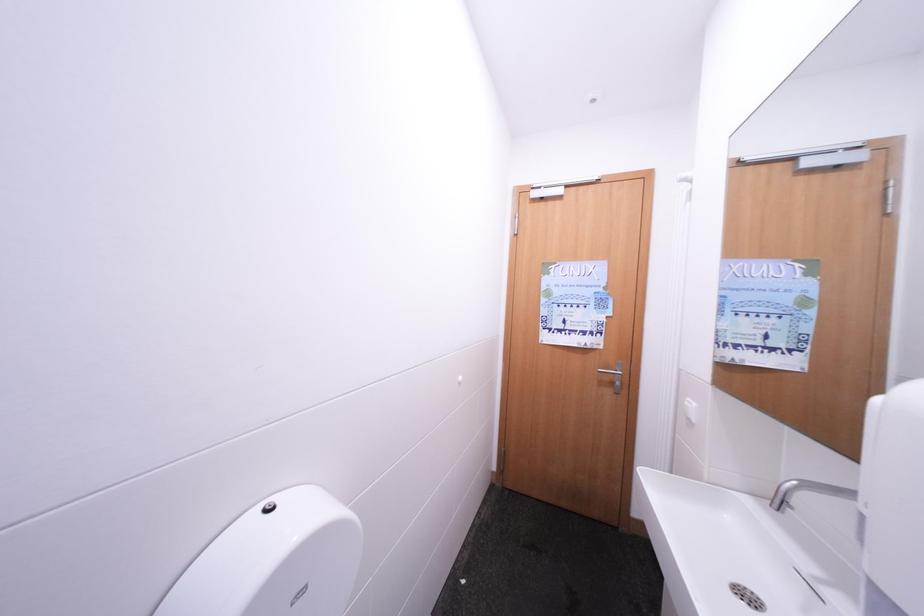
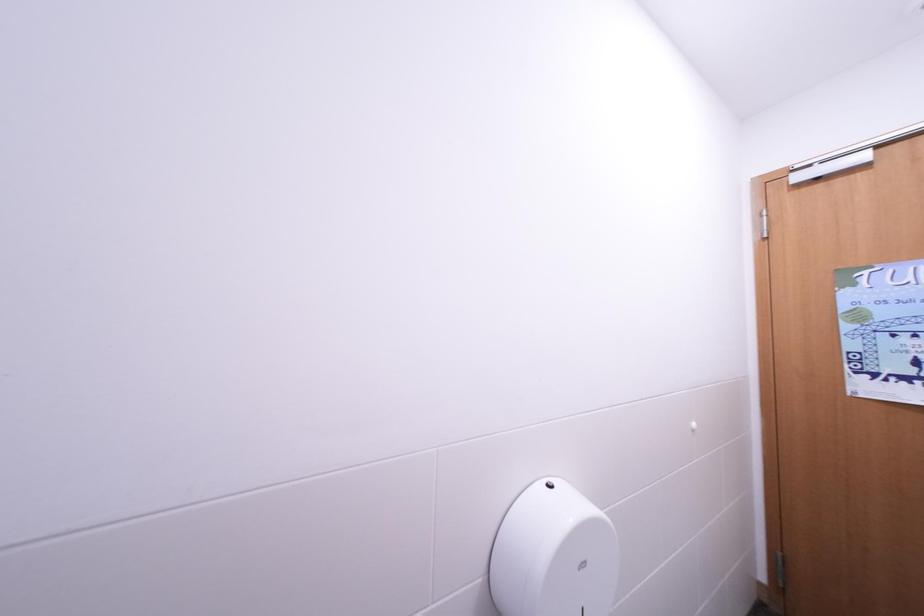
Question: The camera is either moving clockwise (left) or counter-clockwise (right) around the object. The first image is from the beginning of the video and the second image is from the end. Is the camera moving left or right when shooting the video?

Choices:
 (A) Left
 (B) Right

Answer: (B)